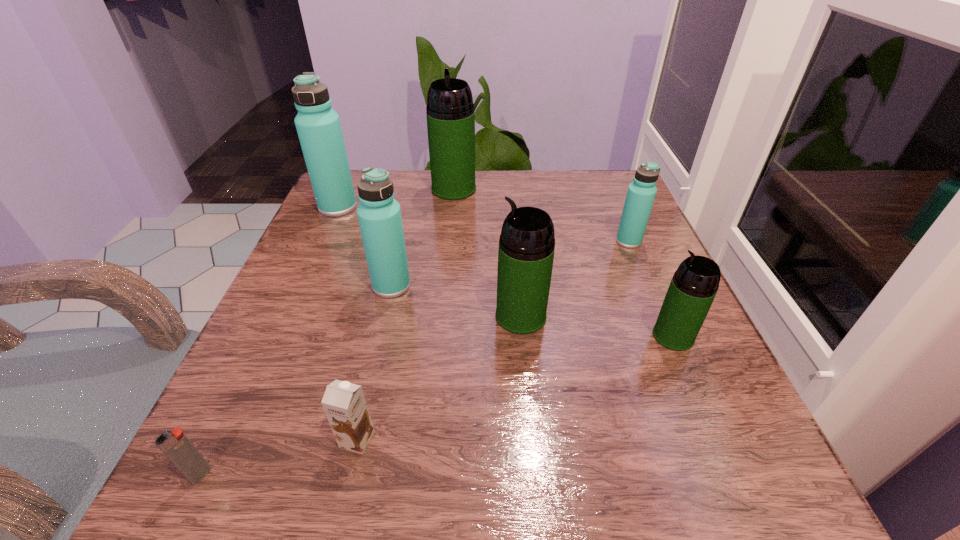
Find the location of a particular element. thermos bottle that can be found as the third closest to the sixth nearest object is located at coordinates (450, 113).

What are the coordinates of `thermos bottle that is the nearest to the third thermos bottle from left to right` in the screenshot? It's located at (318, 126).

You are a GUI agent. You are given a task and a screenshot of the screen. Output one action in this format:
    pyautogui.click(x=<x>, y=<y>)
    Task: Click on the third closest green thermos bottle to the igniter
    The image size is (960, 540).
    Given the screenshot: What is the action you would take?
    pyautogui.click(x=450, y=113)

Select which green thermos bottle is the second closest to the nearest object. Please provide its 2D coordinates. Your answer should be formatted as a tuple, i.e. [(x, y)], where the tuple contains the x and y coordinates of a point satisfying the conditions above.

[(694, 285)]

I want to click on the closest aqua thermos bottle to the leftmost thermos bottle, so click(379, 214).

This screenshot has width=960, height=540. What are the coordinates of `aqua thermos bottle that is the third closest one to the nearest object` in the screenshot? It's located at (641, 192).

This screenshot has width=960, height=540. What are the coordinates of `vacant space that satisfies the following two spatial constraints: 1. on the front side of the third farthest thermos bottle; 2. from the spout of the fourth thermos bottle from left to right` in the screenshot? It's located at (660, 316).

Locate an element on the screen. This screenshot has height=540, width=960. free spot that satisfies the following two spatial constraints: 1. on the front side of the fourth nearest thermos bottle; 2. from the spout of the second smallest green thermos bottle is located at coordinates (660, 316).